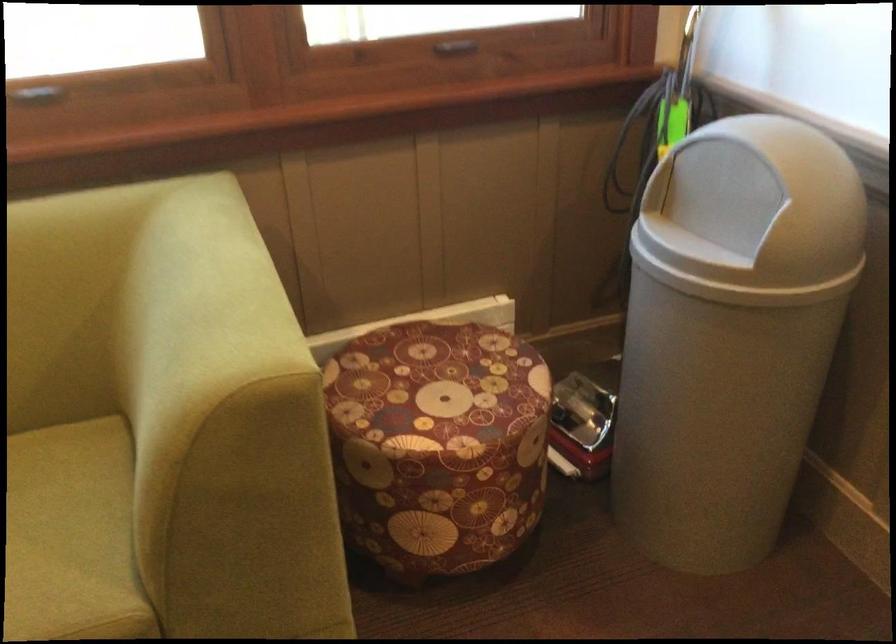
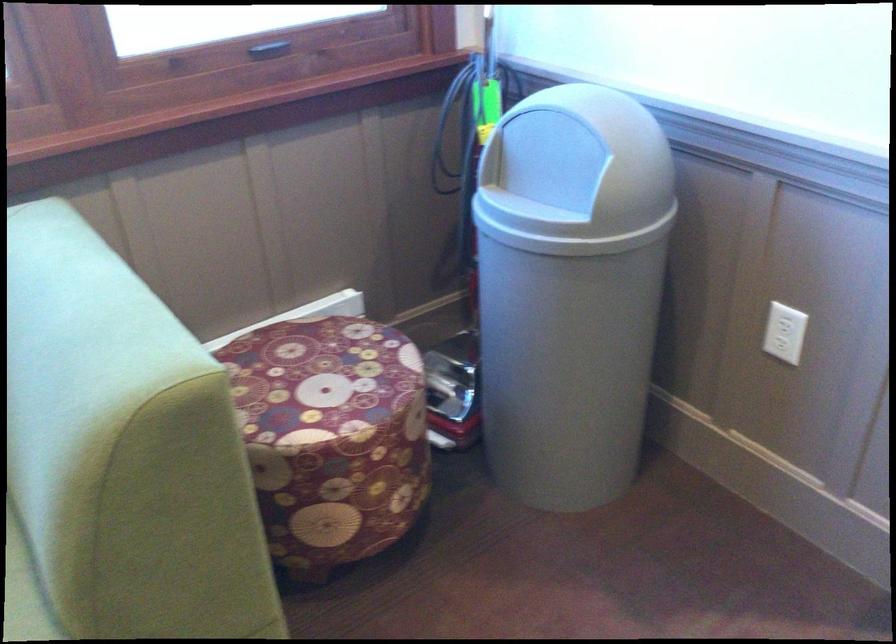
In the second image, find the point that corresponds to (722,209) in the first image.

(550, 174)